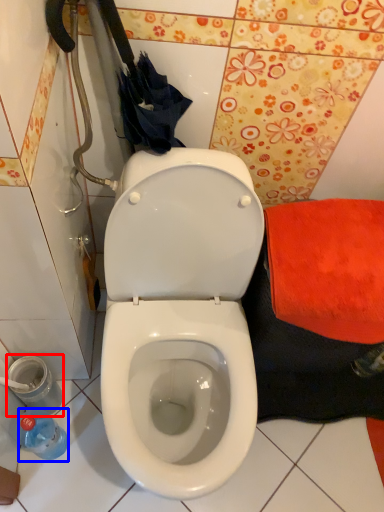
Question: Which of the following is the farthest to the observer, potty (highlighted by a red box) or bottle (highlighted by a blue box)?

Choices:
 (A) potty
 (B) bottle

Answer: (A)